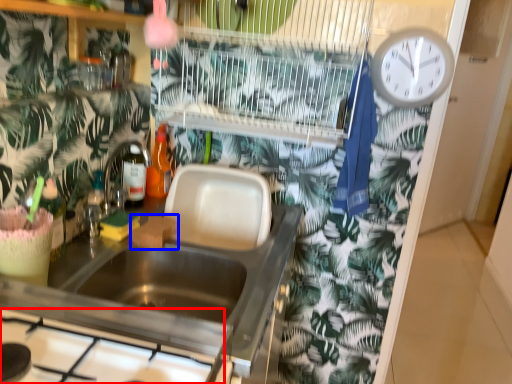
Question: Which object is further to the camera taking this photo, gas stove (highlighted by a red box) or food (highlighted by a blue box)?

Choices:
 (A) gas stove
 (B) food

Answer: (B)